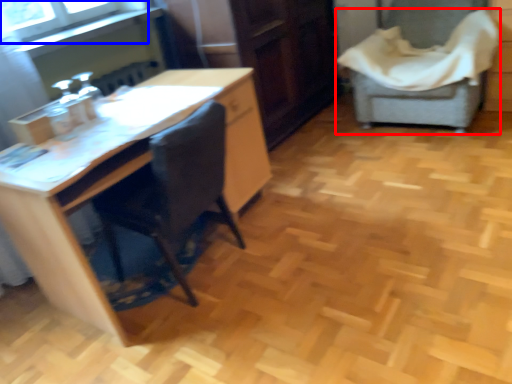
Question: Which of the following is the farthest to the observer, chair (highlighted by a red box) or window screen (highlighted by a blue box)?

Choices:
 (A) chair
 (B) window screen

Answer: (A)